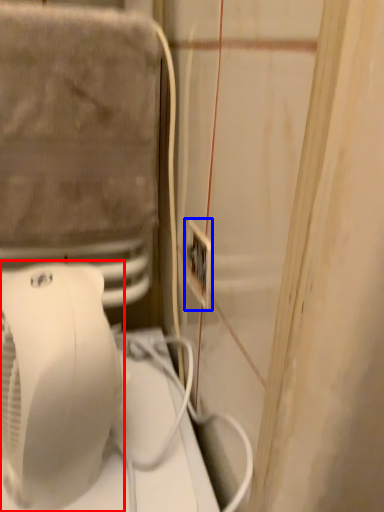
Question: Which object appears closest to the camera in this image, home appliance (highlighted by a red box) or electric outlet (highlighted by a blue box)?

Choices:
 (A) home appliance
 (B) electric outlet

Answer: (A)